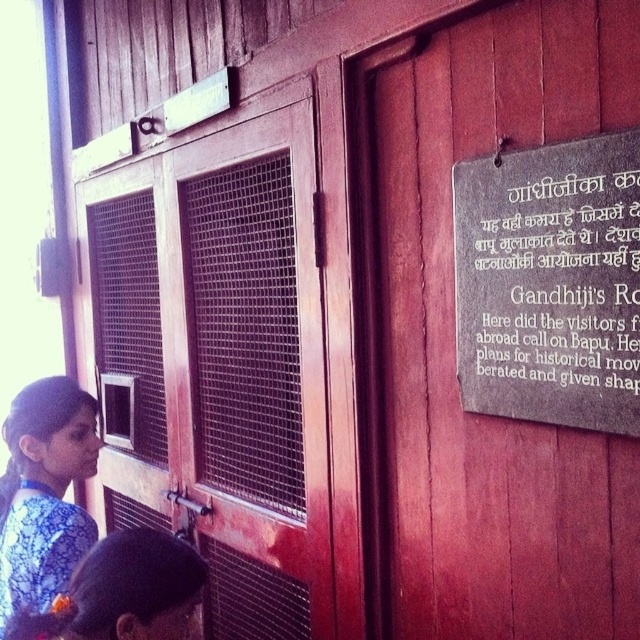
Is wooden door at center wider than blue printed dress at lower left?

Yes.

In order to click on wooden door at center in this screenshot , I will do `click(454, 339)`.

Which is in front, point (520, 476) or point (1, 627)?

Positioned in front is point (520, 476).

Image resolution: width=640 pixels, height=640 pixels. What are the coordinates of `wooden door at center` in the screenshot? It's located at (454, 339).

Which is more to the left, wooden mesh door at center or dark brown stone plaque at right?

Positioned to the left is wooden mesh door at center.

Is wooden mesh door at center to the left of dark brown stone plaque at right from the viewer's perspective?

Indeed, wooden mesh door at center is positioned on the left side of dark brown stone plaque at right.

Image resolution: width=640 pixels, height=640 pixels. Describe the element at coordinates (236, 355) in the screenshot. I see `wooden mesh door at center` at that location.

At what (x,y) coordinates should I click in order to perform the action: click on wooden mesh door at center. Please return your answer as a coordinate pair (x, y). Looking at the image, I should click on (236, 355).

Is dark brown stone plaque at right positioned at the back of blue printed dress at lower left?

No, dark brown stone plaque at right is in front of blue printed dress at lower left.

Is point (632, 257) in front of point (92, 516)?

Yes, point (632, 257) is closer to viewer.

Where is `dark brown stone plaque at right`? The image size is (640, 640). dark brown stone plaque at right is located at coordinates (548, 282).